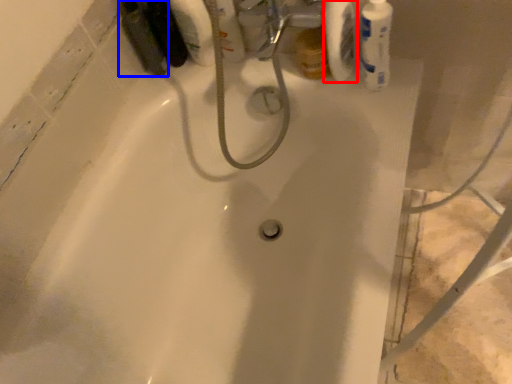
Question: Which of the following is the closest to the observer, toilet paper (highlighted by a red box) or mouthwash (highlighted by a blue box)?

Choices:
 (A) toilet paper
 (B) mouthwash

Answer: (A)